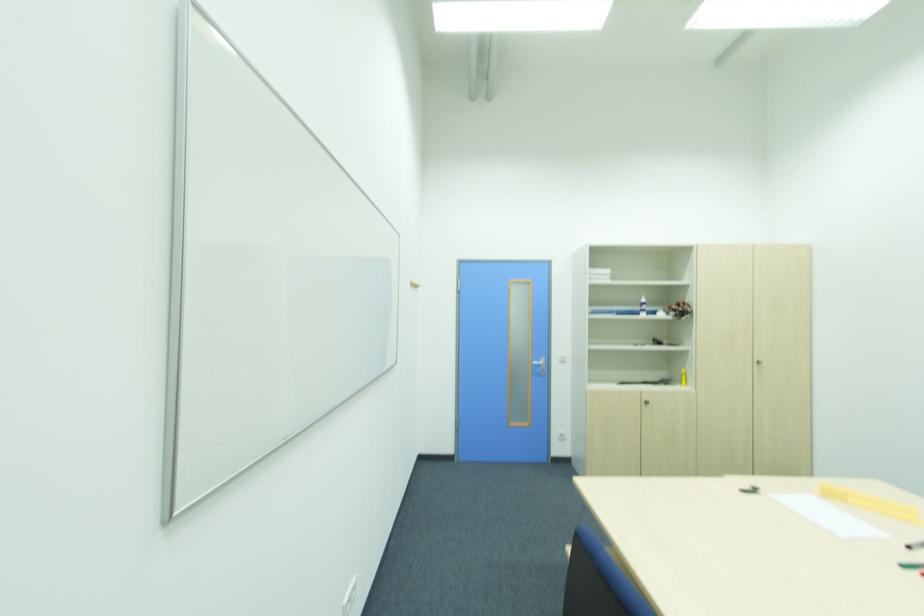
Identify the location of silver cabinet handle. The width and height of the screenshot is (924, 616). (646, 400).